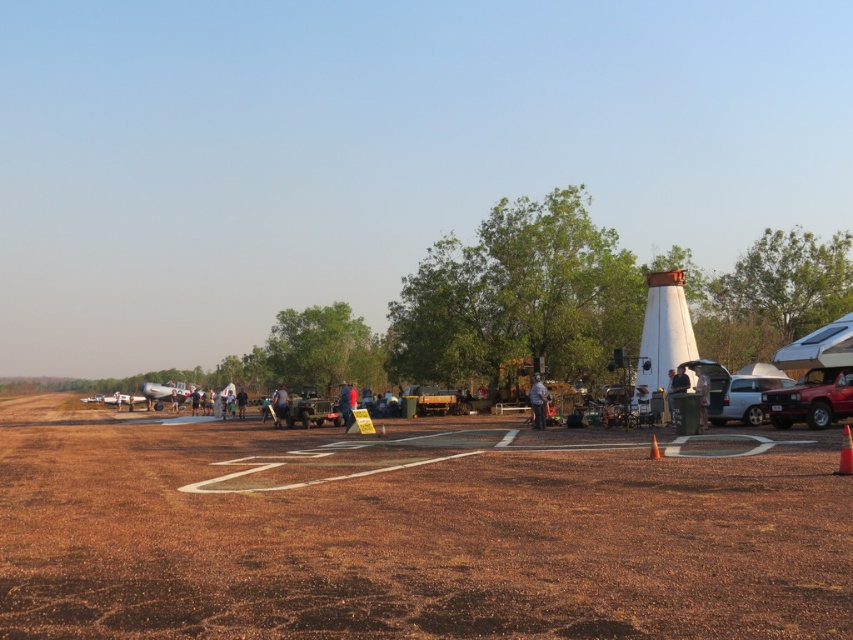
Does light brown leather jacket at center appear on the right side of orange cone at center?

Yes, light brown leather jacket at center is to the right of orange cone at center.

Based on the photo, who is lower down, light brown leather jacket at center or orange cone at center?

orange cone at center is below.

Which is behind, point (675, 392) or point (653, 449)?

The point (675, 392) is behind.

Where is `light brown leather jacket at center`? This screenshot has height=640, width=853. light brown leather jacket at center is located at coordinates (676, 388).

Who is shorter, shiny red car at right or silver metallic car at center-right?

silver metallic car at center-right

Is point (822, 394) less distant than point (759, 392)?

Yes, point (822, 394) is closer to viewer.

Locate an element on the screen. shiny red car at right is located at coordinates (811, 397).

Can you confirm if shiny red car at right is positioned to the right of orange matte traffic cone at center?

Indeed, shiny red car at right is positioned on the right side of orange matte traffic cone at center.

Is shiny red car at right shorter than orange matte traffic cone at center?

No.

The image size is (853, 640). I want to click on shiny red car at right, so click(x=811, y=397).